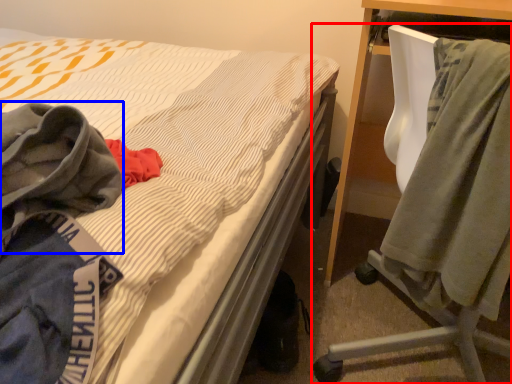
Question: Among these objects, which one is farthest to the camera, chair (highlighted by a red box) or cloak (highlighted by a blue box)?

Choices:
 (A) chair
 (B) cloak

Answer: (A)